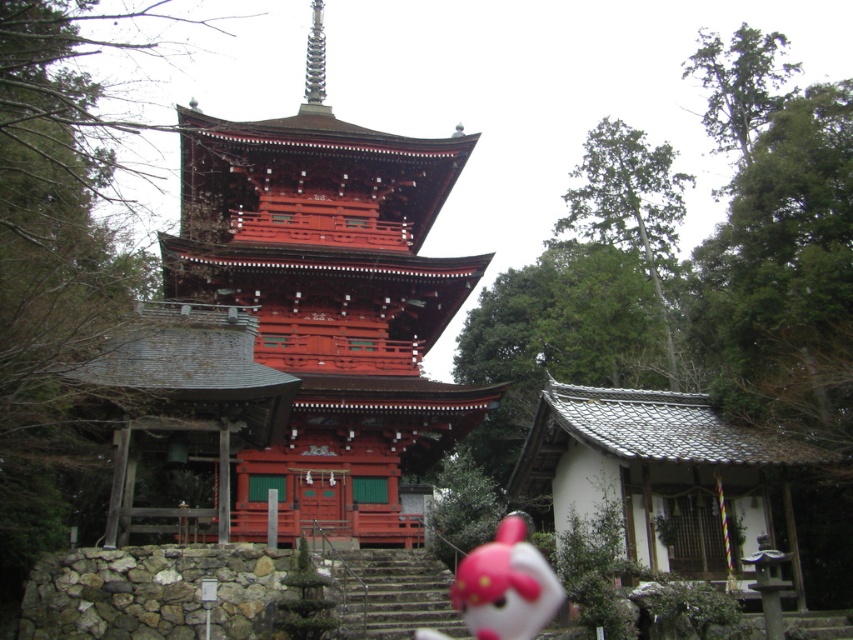
Question: Which object is closer to the camera taking this photo?

Choices:
 (A) shiny lacquered pagoda at center
 (B) stone stairs at center

Answer: (B)

Question: Does shiny lacquered pagoda at center have a smaller size compared to stone stairs at center?

Choices:
 (A) yes
 (B) no

Answer: (B)

Question: Does stone stairs at center come in front of matte pink plush toy at lower center?

Choices:
 (A) yes
 (B) no

Answer: (A)

Question: Among these objects, which one is nearest to the camera?

Choices:
 (A) stone stairs at center
 (B) matte pink plush toy at lower center

Answer: (A)

Question: Can you confirm if shiny lacquered pagoda at center is bigger than matte pink plush toy at lower center?

Choices:
 (A) yes
 (B) no

Answer: (A)

Question: Among these points, which one is nearest to the camera?

Choices:
 (A) [x=331, y=337]
 (B) [x=486, y=563]

Answer: (B)